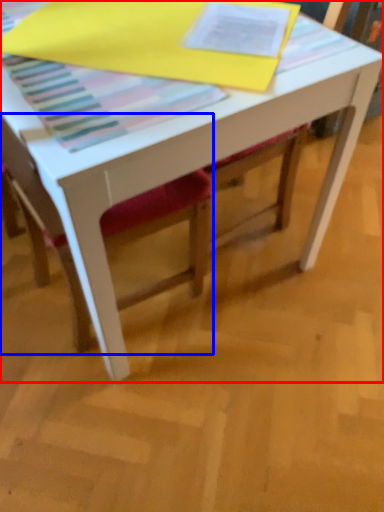
Question: Among these objects, which one is nearest to the camera, table (highlighted by a red box) or chair (highlighted by a blue box)?

Choices:
 (A) table
 (B) chair

Answer: (B)